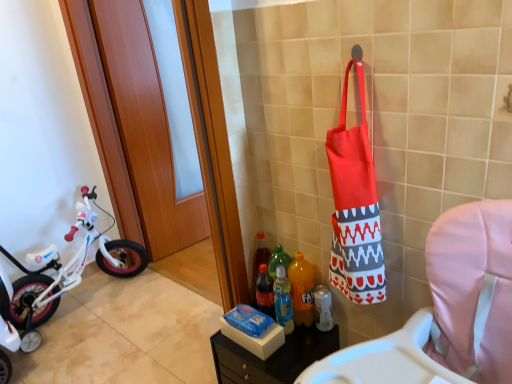
Find the location of `free space in front of white matte bicycle at left`. free space in front of white matte bicycle at left is located at coordinates (82, 354).